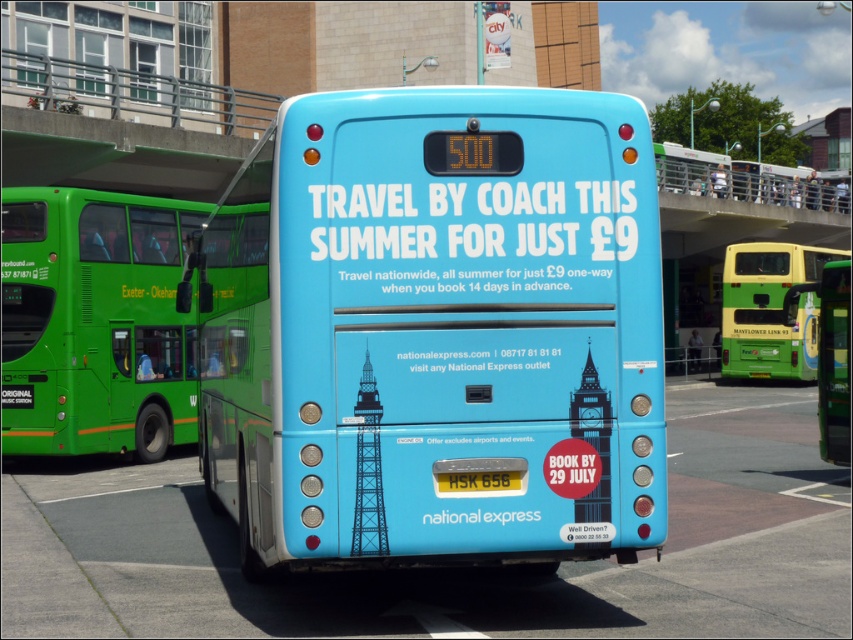
This screenshot has height=640, width=853. What do you see at coordinates (99, 321) in the screenshot?
I see `green matte bus at left` at bounding box center [99, 321].

Is green matte bus at left positioned behind yellow metallic license plate at center?

Yes, it is.

Identify the location of green matte bus at left. (99, 321).

Which is in front, point (753, 316) or point (480, 481)?

Point (480, 481) is more forward.

Which is behind, point (730, 369) or point (444, 472)?

The point (730, 369) is more distant.

Where is `yellow-green plastic bus at right`? yellow-green plastic bus at right is located at coordinates (770, 308).

Between point (509, 99) and point (54, 385), which one is positioned behind?

The point (54, 385) is more distant.

What do you see at coordinates (436, 330) in the screenshot? I see `matte blue bus at center` at bounding box center [436, 330].

Between point (634, 374) and point (123, 292), which one is positioned behind?

The point (123, 292) is behind.

Locate an element on the screen. matte blue bus at center is located at coordinates (436, 330).